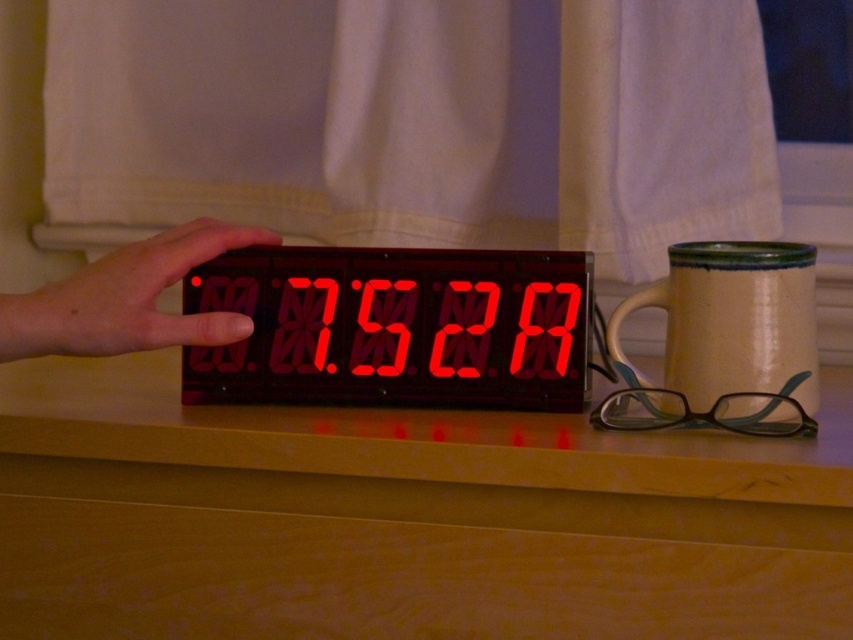
Consider the image. Does wooden table at center come in front of matte black hand at center?

Yes, it is.

Which of these two, wooden table at center or matte black hand at center, stands shorter?

matte black hand at center

Is point (699, 545) positioned after point (76, 348)?

No.

Find the location of a particular element. This screenshot has width=853, height=640. wooden table at center is located at coordinates (404, 518).

Where is `red led display at center`? This screenshot has height=640, width=853. red led display at center is located at coordinates (395, 326).

Consider the image. How distant is red led display at center from matte ceramic mug at right?

5.39 inches

The height and width of the screenshot is (640, 853). What are the coordinates of `red led display at center` in the screenshot? It's located at (395, 326).

Is wooden table at center bigger than matte ceramic mug at right?

Correct, wooden table at center is larger in size than matte ceramic mug at right.

Can you confirm if wooden table at center is smaller than matte ceramic mug at right?

No, wooden table at center is not smaller than matte ceramic mug at right.

Who is more forward, (x=625, y=433) or (x=776, y=392)?

Positioned in front is point (x=776, y=392).

Locate an element on the screen. The width and height of the screenshot is (853, 640). wooden table at center is located at coordinates (404, 518).